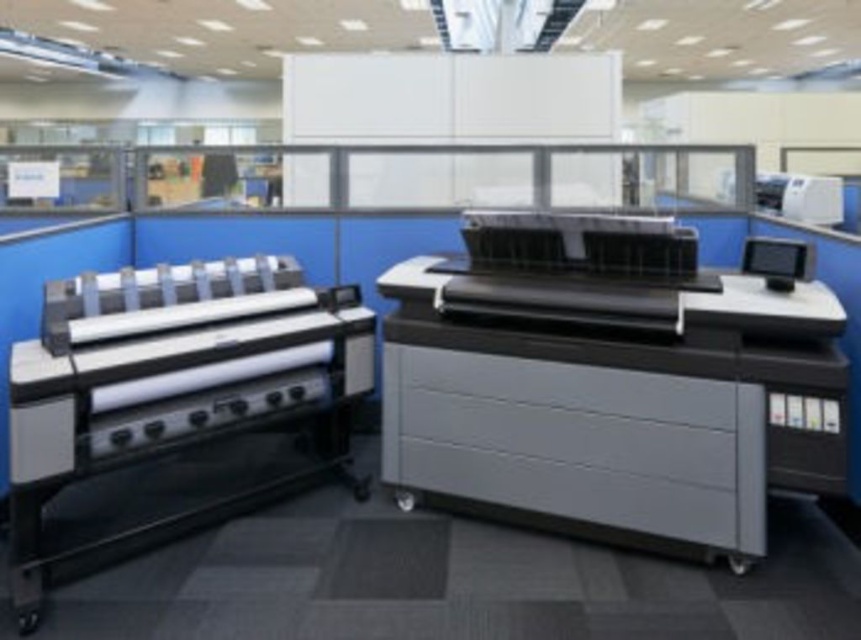
Question: Which object is positioned farthest from the matte black printer at center?

Choices:
 (A) matte black printer at left
 (B) white plastic printer at upper right

Answer: (B)

Question: Can you confirm if matte black printer at center is thinner than white plastic printer at upper right?

Choices:
 (A) yes
 (B) no

Answer: (B)

Question: From the image, what is the correct spatial relationship of matte black printer at center in relation to matte black printer at left?

Choices:
 (A) left
 (B) right

Answer: (B)

Question: Can you confirm if matte black printer at center is positioned to the right of matte black printer at left?

Choices:
 (A) yes
 (B) no

Answer: (A)

Question: Which point is farther to the camera?

Choices:
 (A) (841, 205)
 (B) (444, 353)
 (C) (759, 266)

Answer: (A)

Question: Which point is closer to the camera?

Choices:
 (A) black glossy monitor at upper right
 (B) matte black printer at center

Answer: (B)